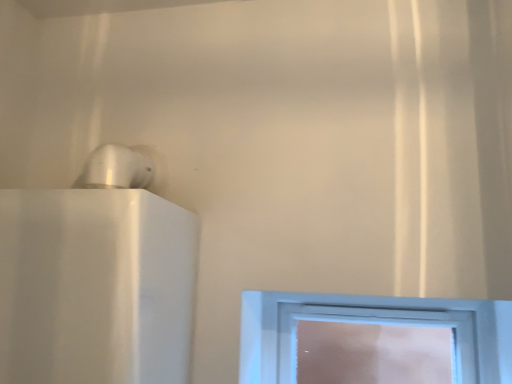
Question: From the image's perspective, relative to white glossy speaker at upper left, is clear glass window at center above or below?

Choices:
 (A) above
 (B) below

Answer: (B)

Question: From a real-world perspective, relative to white glossy speaker at upper left, is clear glass window at center vertically above or below?

Choices:
 (A) above
 (B) below

Answer: (B)

Question: Considering their positions, is clear glass window at center located in front of or behind white glossy speaker at upper left?

Choices:
 (A) front
 (B) behind

Answer: (B)

Question: Looking at their shapes, would you say white glossy speaker at upper left is wider or thinner than clear glass window at center?

Choices:
 (A) wide
 (B) thin

Answer: (A)

Question: Is white glossy speaker at upper left to the left or to the right of clear glass window at center in the image?

Choices:
 (A) left
 (B) right

Answer: (A)

Question: Is white glossy speaker at upper left in front of or behind clear glass window at center in the image?

Choices:
 (A) behind
 (B) front

Answer: (B)

Question: From a real-world perspective, is white glossy speaker at upper left positioned above or below clear glass window at center?

Choices:
 (A) below
 (B) above

Answer: (B)